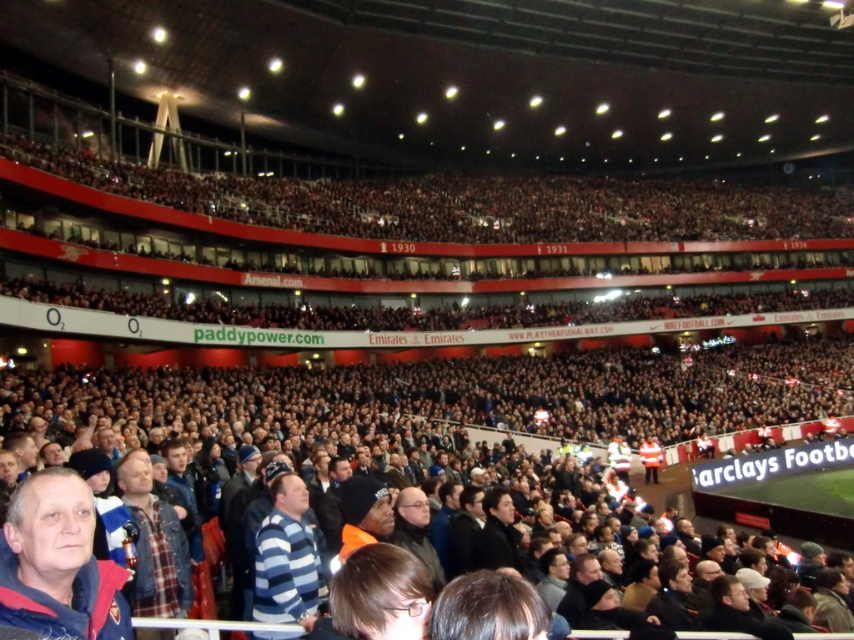
Question: Can you confirm if striped cotton shirt at center is thinner than black leather jacket at center?

Choices:
 (A) yes
 (B) no

Answer: (A)

Question: Which of the following is the farthest from the observer?

Choices:
 (A) (405, 529)
 (B) (500, 547)
 (C) (308, 595)

Answer: (B)

Question: Which of the following is the farthest from the observer?

Choices:
 (A) blue plaid shirt at lower left
 (B) black leather jacket at center
 (C) dark gray jacket at center
 (D) striped cotton shirt at center

Answer: (B)

Question: Is black leather jacket at center smaller than dark gray jacket at center?

Choices:
 (A) yes
 (B) no

Answer: (B)

Question: Which point is closer to the camera taking this photo?

Choices:
 (A) (436, 577)
 (B) (490, 564)

Answer: (A)

Question: In this image, where is striped cotton shirt at center located relative to dark gray jacket at center?

Choices:
 (A) right
 (B) left

Answer: (B)